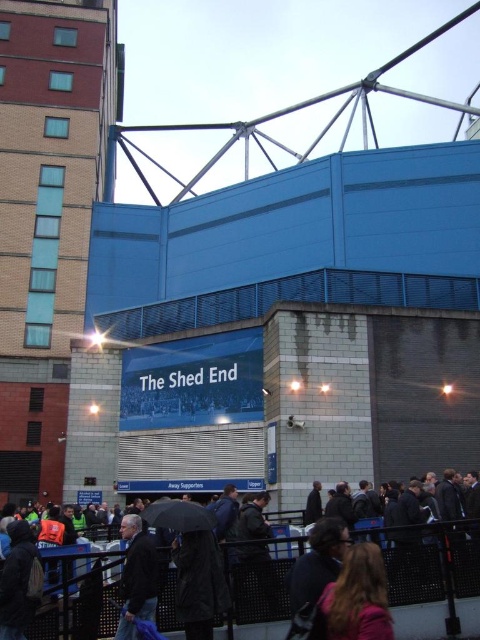
You are a photographer standing at the base of the Shed End structure. You want to take a photo that includes both the blonde hair at lower center and the black matte umbrella at lower center. What is the minimum distance you need to move backward to ensure both objects are in frame?

The blonde hair at lower center and the black matte umbrella at lower center are 6.86 meters apart from each other. To capture both in a single frame, you need to move back until your camera can encompass this distance within its field of view. The exact distance depends on your camera lens, but generally, moving back to at least 7 meters should ensure both objects are visible.

In the scene of the Shed End stadium section, you notice two items at the lower center area. Which object is positioned to the right when viewing the blonde hair at lower center and the black matte umbrella at lower center?

The blonde hair at lower center is positioned to the right of the black matte umbrella at lower center.